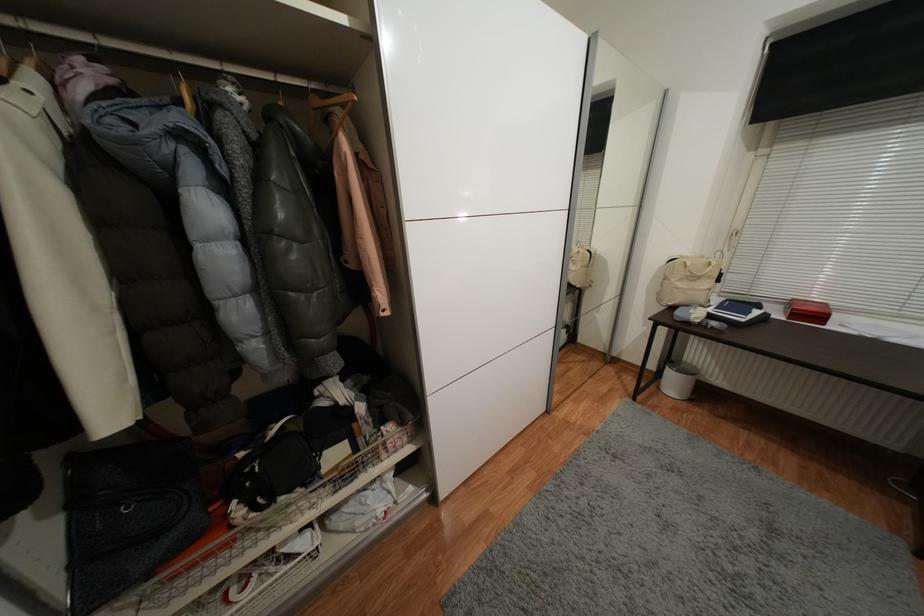
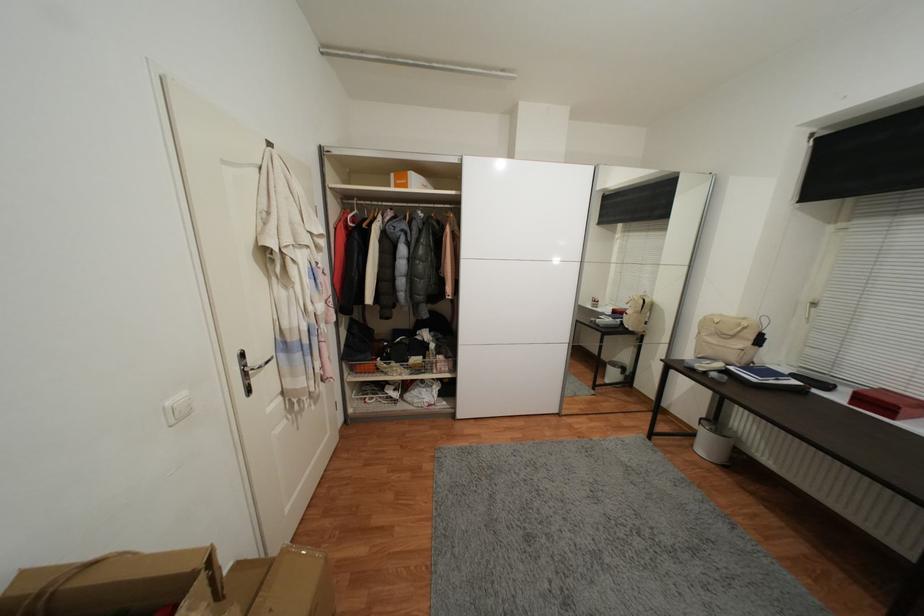
Find the pixel in the second image that matches point (747, 321) in the first image.

(759, 381)